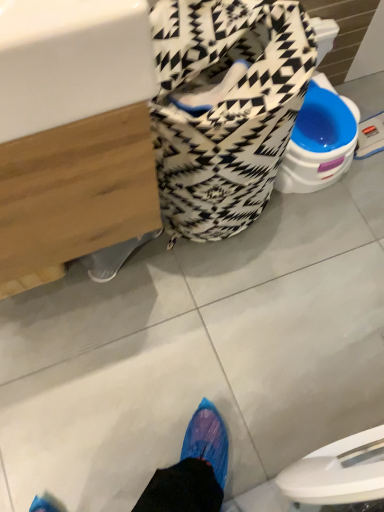
What do you see at coordinates (224, 106) in the screenshot?
I see `patterned fabric laundry basket at center` at bounding box center [224, 106].

Find the location of `patterned fabric laundry basket at center`. patterned fabric laundry basket at center is located at coordinates (224, 106).

What do you see at coordinates (72, 133) in the screenshot? The height and width of the screenshot is (512, 384). I see `white glossy sink at upper left` at bounding box center [72, 133].

Identify the location of white glossy sink at upper left. (72, 133).

What are the coordinates of `patterned fabric laundry basket at center` in the screenshot? It's located at (224, 106).

Which is more to the left, patterned fabric laundry basket at center or white glossy sink at upper left?

white glossy sink at upper left is more to the left.

Does patterned fabric laundry basket at center come behind white glossy sink at upper left?

That is True.

Does point (301, 28) come in front of point (134, 74)?

No, (301, 28) is behind (134, 74).

From the image's perspective, is patterned fabric laundry basket at center above white glossy sink at upper left?

Correct, patterned fabric laundry basket at center appears higher than white glossy sink at upper left in the image.

From a real-world perspective, is patterned fabric laundry basket at center positioned over white glossy sink at upper left based on gravity?

No, from a real-world perspective, patterned fabric laundry basket at center is not on top of white glossy sink at upper left.

Considering the relative sizes of patterned fabric laundry basket at center and white glossy sink at upper left in the image provided, is patterned fabric laundry basket at center wider than white glossy sink at upper left?

In fact, patterned fabric laundry basket at center might be narrower than white glossy sink at upper left.

Which of these two, patterned fabric laundry basket at center or white glossy sink at upper left, stands taller?

white glossy sink at upper left is taller.

Based on the photo, is patterned fabric laundry basket at center bigger or smaller than white glossy sink at upper left?

Considering their sizes, patterned fabric laundry basket at center takes up less space than white glossy sink at upper left.

Is patterned fabric laundry basket at center situated inside white glossy sink at upper left or outside?

patterned fabric laundry basket at center is outside white glossy sink at upper left.

Are patterned fabric laundry basket at center and white glossy sink at upper left making contact?

No, patterned fabric laundry basket at center is not with white glossy sink at upper left.

Is patterned fabric laundry basket at center facing towards white glossy sink at upper left?

No, patterned fabric laundry basket at center is not facing towards white glossy sink at upper left.

Identify the location of sink lying on the left of patterned fabric laundry basket at center. (72, 133).

In the image, is white glossy sink at upper left on the left side or the right side of patterned fabric laundry basket at center?

From the image, it's evident that white glossy sink at upper left is to the left of patterned fabric laundry basket at center.

Is white glossy sink at upper left behind patterned fabric laundry basket at center?

No, white glossy sink at upper left is closer to the camera.

Which point is more forward, (109, 101) or (251, 108)?

The point (109, 101) is closer to the camera.

From the image's perspective, is white glossy sink at upper left located above or below patterned fabric laundry basket at center?

white glossy sink at upper left is below patterned fabric laundry basket at center.

From a real-world perspective, which object rests below the other?

From a 3D spatial view, patterned fabric laundry basket at center is below.

Does white glossy sink at upper left have a lesser width compared to patterned fabric laundry basket at center?

In fact, white glossy sink at upper left might be wider than patterned fabric laundry basket at center.

Who is taller, white glossy sink at upper left or patterned fabric laundry basket at center?

white glossy sink at upper left is taller.

Who is bigger, white glossy sink at upper left or patterned fabric laundry basket at center?

white glossy sink at upper left.

Would you say white glossy sink at upper left is outside patterned fabric laundry basket at center?

Yes, white glossy sink at upper left is located beyond the bounds of patterned fabric laundry basket at center.

Is white glossy sink at upper left next to patterned fabric laundry basket at center and touching it?

No, white glossy sink at upper left is not beside patterned fabric laundry basket at center.

Is white glossy sink at upper left facing away from patterned fabric laundry basket at center?

No, patterned fabric laundry basket at center is not at the back of white glossy sink at upper left.

How different are the orientations of white glossy sink at upper left and patterned fabric laundry basket at center in degrees?

1.7 degrees.

I want to click on laundry basket on the right side of white glossy sink at upper left, so click(x=224, y=106).

The width and height of the screenshot is (384, 512). There is a patterned fabric laundry basket at center. Find the location of `sink above it (from a real-world perspective)`. sink above it (from a real-world perspective) is located at coordinates (72, 133).

In order to click on sink below the patterned fabric laundry basket at center (from the image's perspective) in this screenshot , I will do `click(72, 133)`.